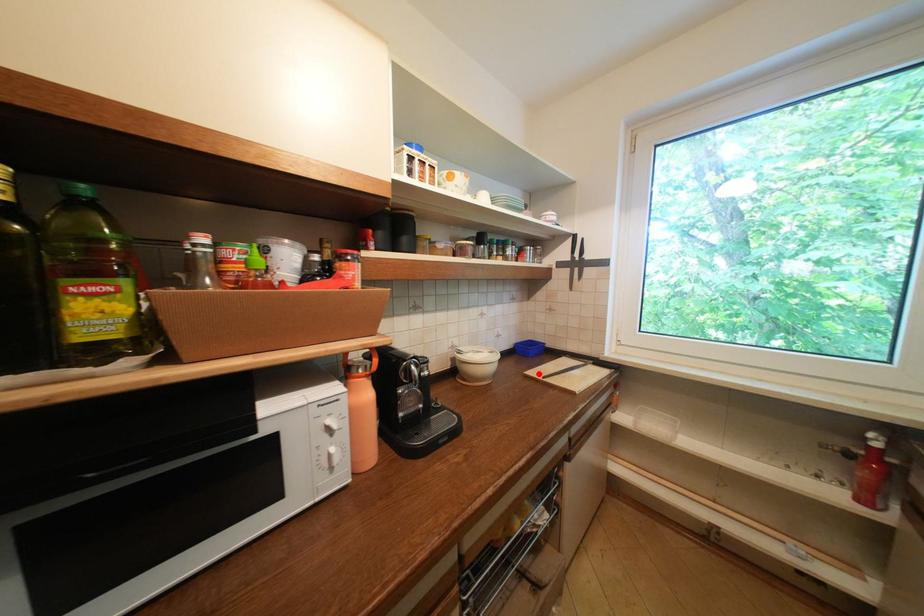
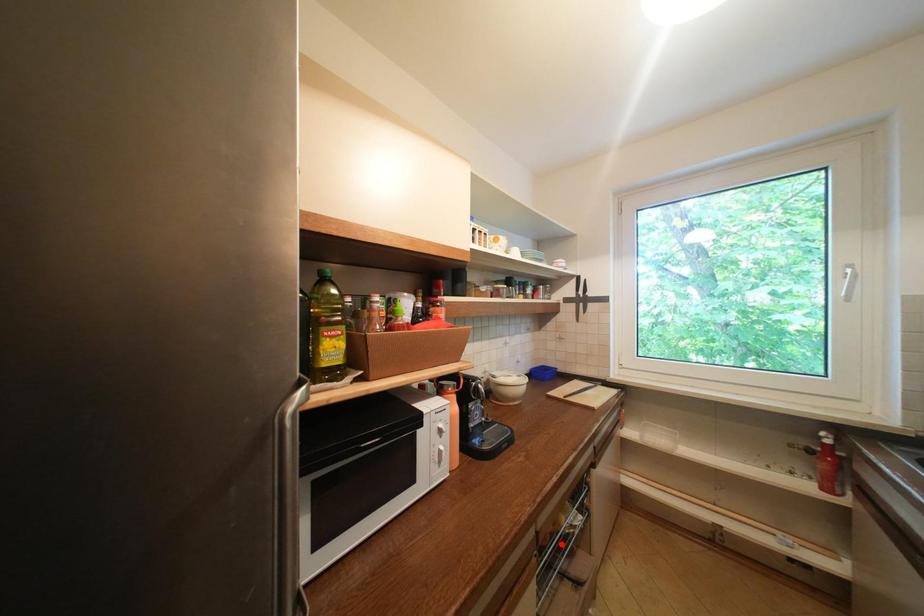
I am providing you with two images of the same scene from different viewpoints. A red point is marked on the first image and another point is marked on the second image. Do the highlighted points in image1 and image2 indicate the same real-world spot?

No